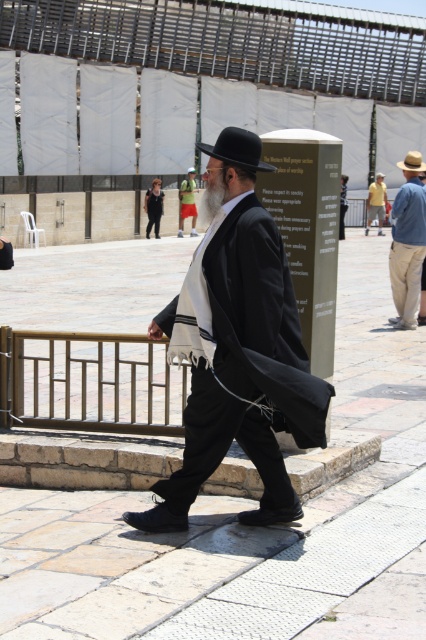
Based on the scene description, can you determine if the black matte coat at center is wider than the yellow cotton shirt at upper right?

The black matte coat at center might be wider than yellow cotton shirt at upper right according to the description.

Consider the image. You are a visitor at the Western Wall and notice two robes worn by men standing at the center. The first is a black woolen robe at center, and the second is a silky black robe at center. Which robe is wider?

The silky black robe at center is wider than the black woolen robe at center.